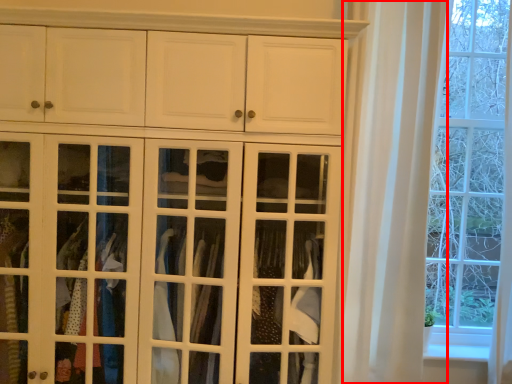
Question: From the image, what is the correct spatial relationship of curtain (annotated by the red box) in relation to door?

Choices:
 (A) left
 (B) right

Answer: (B)